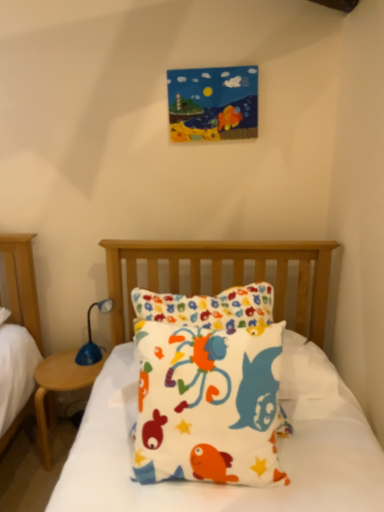
Question: In the image, is blue plastic table lamp at left positioned in front of or behind wooden at left?

Choices:
 (A) front
 (B) behind

Answer: (B)

Question: Looking at the image, does blue plastic table lamp at left seem bigger or smaller compared to wooden at left?

Choices:
 (A) big
 (B) small

Answer: (B)

Question: Which object is the closest to the wooden at left?

Choices:
 (A) fluffy cotton pillow at center
 (B) blue plastic table lamp at left

Answer: (B)

Question: Based on their relative distances, which object is farther from the wooden at left?

Choices:
 (A) fluffy cotton pillow at center
 (B) blue plastic table lamp at left

Answer: (A)